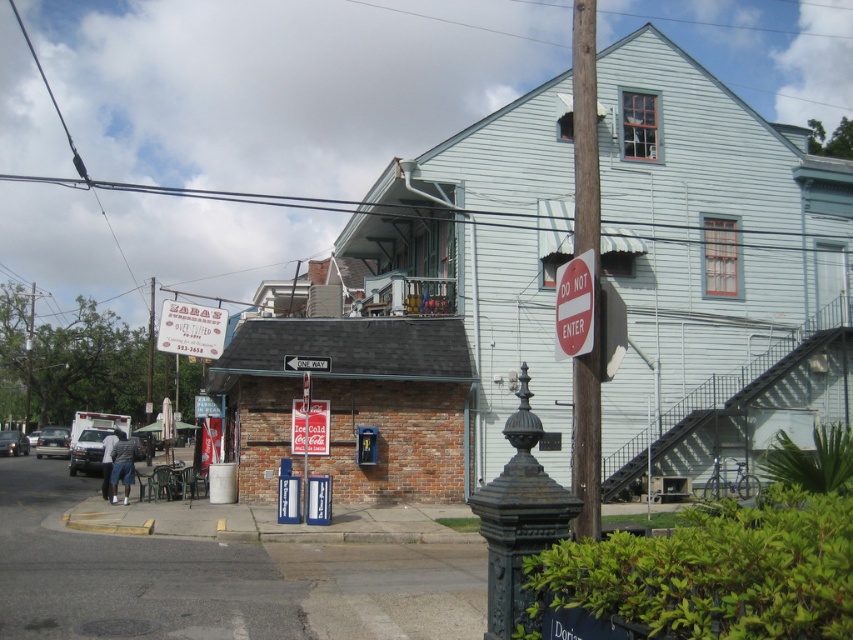
You are a delivery driver approaching the house and need to park your matte black car at lower left. There is a metallic silver sign at center blocking the parking spot. Can you move the sign to make space?

The metallic silver sign at center is smaller than the matte black car at lower left, so you can move the metallic silver sign at center to make space for the matte black car at lower left.

You are a pedestrian standing at the intersection near the black ornate metal post. You want to cross the street to the two story light blue house. Which vehicle, the white matte van at lower left or the matte black car at lower left, is closer to the curb where you are standing?

The matte black car at lower left is closer to the curb where you are standing because the white matte van at lower left is to the right of it.